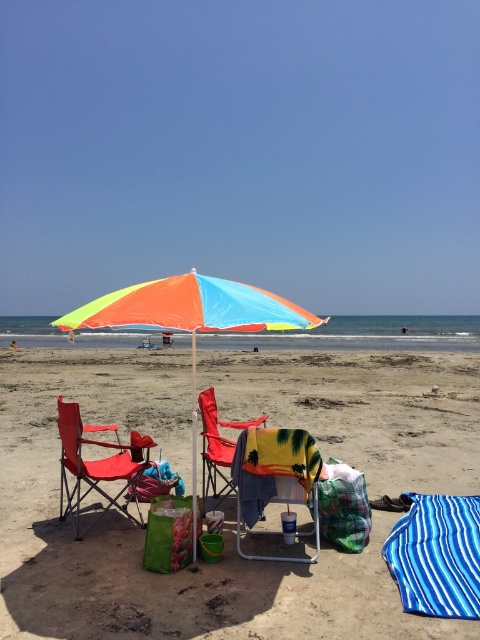
You are a beachgoer who wants to place a small toy on the ground between the beige sand at center and the matte red beach chair at center. Based on their heights, which object should the toy be placed closer to?

The beige sand at center is not as tall as the matte red beach chair at center, so the toy should be placed closer to the beige sand at center since it is shorter.